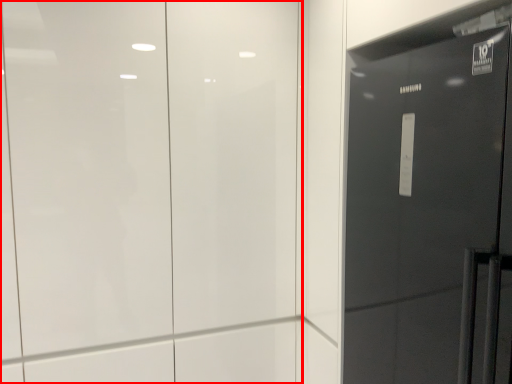
Question: From the image's perspective, what is the correct spatial relationship of door (annotated by the red box) in relation to door?

Choices:
 (A) above
 (B) below

Answer: (A)